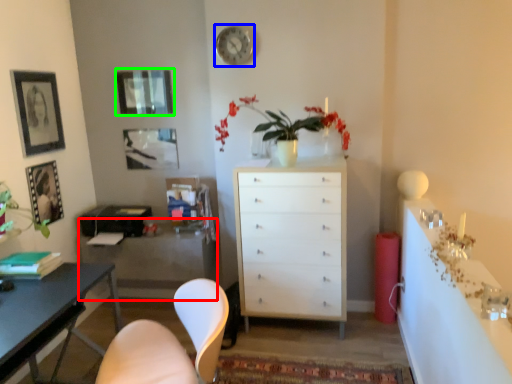
Question: Considering the real-world distances, which object is farthest from cabinetry (highlighted by a red box)? clock (highlighted by a blue box) or picture frame (highlighted by a green box)?

Choices:
 (A) clock
 (B) picture frame

Answer: (A)